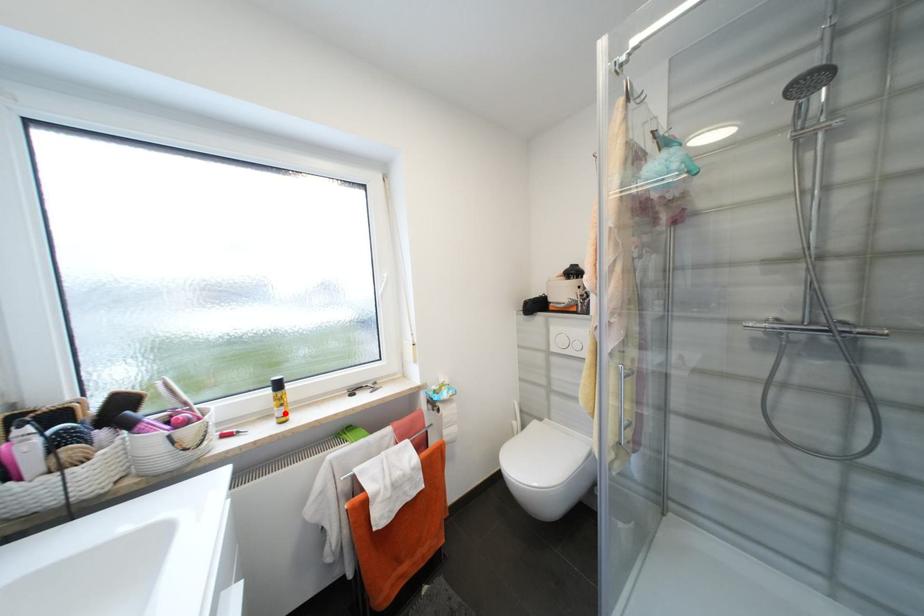
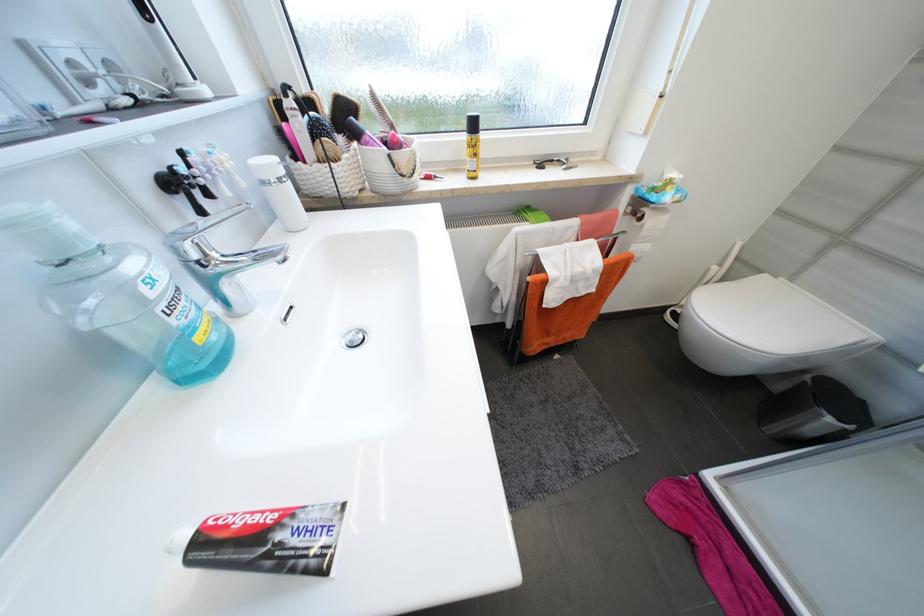
In the second image, find the point that corresponds to the highlighted location in the first image.

(477, 166)